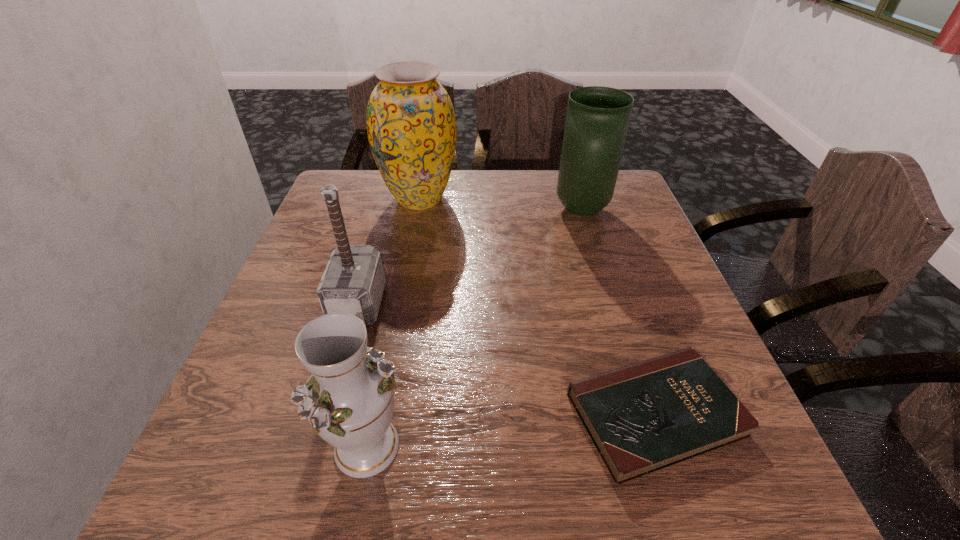
The height and width of the screenshot is (540, 960). What are the coordinates of `vase that is at the left edge` in the screenshot? It's located at (411, 125).

Where is `hammer that is at the left edge`? hammer that is at the left edge is located at coordinates (353, 282).

I want to click on vase situated at the right edge, so click(x=597, y=119).

Identify the location of Bible that is at the right edge. Image resolution: width=960 pixels, height=540 pixels. (643, 417).

Where is `object located in the far left corner section of the desktop`? The width and height of the screenshot is (960, 540). object located in the far left corner section of the desktop is located at coordinates (411, 125).

The height and width of the screenshot is (540, 960). Identify the location of object present at the far right corner. (597, 119).

You are a GUI agent. You are given a task and a screenshot of the screen. Output one action in this format:
    pyautogui.click(x=<x>, y=<y>)
    Task: Click on the object present at the near right corner
    
    Given the screenshot: What is the action you would take?
    pyautogui.click(x=643, y=417)

Image resolution: width=960 pixels, height=540 pixels. Find the location of `free region at the far edge of the desktop`. free region at the far edge of the desktop is located at coordinates (520, 188).

At what (x,y) coordinates should I click in order to perform the action: click on free space at the near edge of the desktop. Please return your answer as a coordinate pair (x, y). Image resolution: width=960 pixels, height=540 pixels. Looking at the image, I should click on (513, 472).

Image resolution: width=960 pixels, height=540 pixels. Identify the location of free space at the left edge. (282, 313).